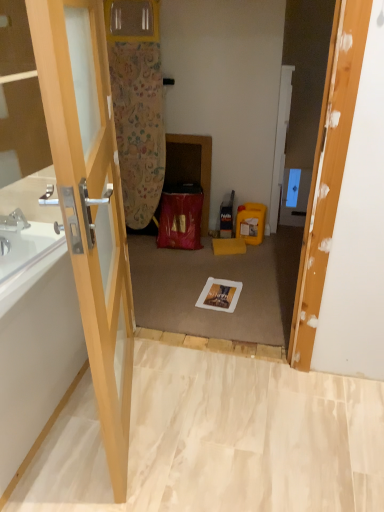
Where is `free space to the right of transparent glass door at left`? free space to the right of transparent glass door at left is located at coordinates (216, 418).